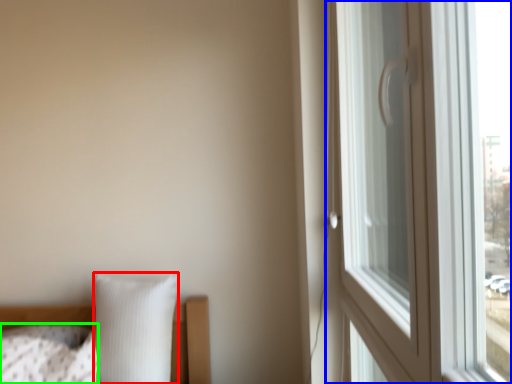
Question: Which object is the closest to the pillow (highlighted by a red box)? Choose among these: window (highlighted by a blue box) or pillow (highlighted by a green box).

Choices:
 (A) window
 (B) pillow

Answer: (B)